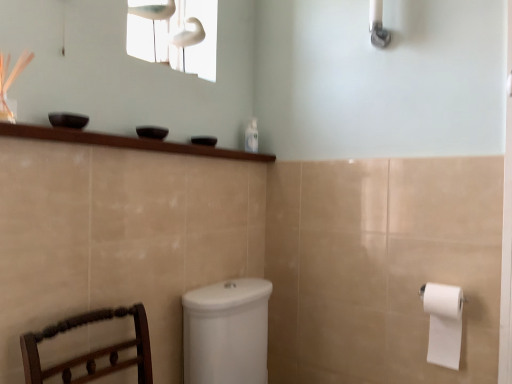
Question: Does white glossy window screen at upper center have a greater width compared to clear plastic bottle at upper center?

Choices:
 (A) yes
 (B) no

Answer: (A)

Question: Does white glossy window screen at upper center appear on the left side of clear plastic bottle at upper center?

Choices:
 (A) yes
 (B) no

Answer: (A)

Question: Considering the relative sizes of white glossy window screen at upper center and clear plastic bottle at upper center in the image provided, is white glossy window screen at upper center smaller than clear plastic bottle at upper center?

Choices:
 (A) yes
 (B) no

Answer: (B)

Question: From the image's perspective, does white glossy window screen at upper center appear lower than clear plastic bottle at upper center?

Choices:
 (A) yes
 (B) no

Answer: (B)

Question: From the image's perspective, would you say white glossy window screen at upper center is positioned over clear plastic bottle at upper center?

Choices:
 (A) yes
 (B) no

Answer: (A)

Question: In terms of size, does white glossy window screen at upper center appear bigger or smaller than white glossy shower head at upper right?

Choices:
 (A) big
 (B) small

Answer: (A)

Question: In the image, is white glossy window screen at upper center on the left side or the right side of white glossy shower head at upper right?

Choices:
 (A) right
 (B) left

Answer: (B)

Question: From a real-world perspective, relative to white glossy shower head at upper right, is white glossy window screen at upper center vertically above or below?

Choices:
 (A) below
 (B) above

Answer: (A)

Question: Is point (153, 41) positioned closer to the camera than point (372, 39)?

Choices:
 (A) closer
 (B) farther

Answer: (B)

Question: Is white glossy window screen at upper center in front of or behind white matte toilet paper at right in the image?

Choices:
 (A) front
 (B) behind

Answer: (B)

Question: Based on their positions, is white glossy window screen at upper center located to the left or right of white matte toilet paper at right?

Choices:
 (A) right
 (B) left

Answer: (B)

Question: Is white glossy window screen at upper center situated inside white matte toilet paper at right or outside?

Choices:
 (A) inside
 (B) outside

Answer: (B)

Question: From the image's perspective, is white glossy window screen at upper center located above or below white matte toilet paper at right?

Choices:
 (A) below
 (B) above

Answer: (B)

Question: From a real-world perspective, is clear plastic bottle at upper center physically located above or below white glossy window screen at upper center?

Choices:
 (A) above
 (B) below

Answer: (B)

Question: Is point tap(248, 147) closer or farther from the camera than point tap(188, 19)?

Choices:
 (A) closer
 (B) farther

Answer: (B)